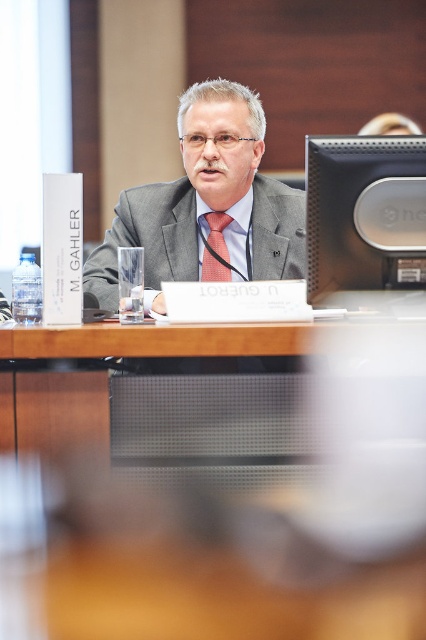
Question: Is sleek black monitor at upper center positioned behind orange checkered tie at center?

Choices:
 (A) yes
 (B) no

Answer: (B)

Question: Can you confirm if sleek black monitor at upper center is wider than orange checkered tie at center?

Choices:
 (A) no
 (B) yes

Answer: (B)

Question: Does matte gray suit at center lie in front of sleek black monitor at upper center?

Choices:
 (A) no
 (B) yes

Answer: (A)

Question: Which object is farther from the camera taking this photo?

Choices:
 (A) matte gray suit at center
 (B) orange checkered tie at center
 (C) sleek black monitor at upper center

Answer: (B)

Question: Among these points, which one is farthest from the camera?

Choices:
 (A) (293, 240)
 (B) (213, 273)
 (C) (330, 168)

Answer: (B)

Question: Which object is the farthest from the orange checkered tie at center?

Choices:
 (A) sleek black monitor at upper center
 (B) matte gray suit at center

Answer: (A)